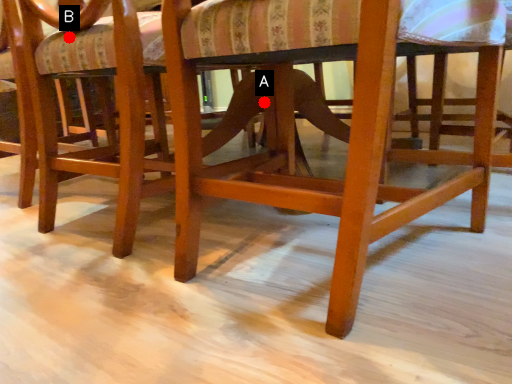
Question: Two points are circled on the image, labeled by A and B beside each circle. Which point appears farthest from the camera in this image?

Choices:
 (A) A is further
 (B) B is further

Answer: (A)